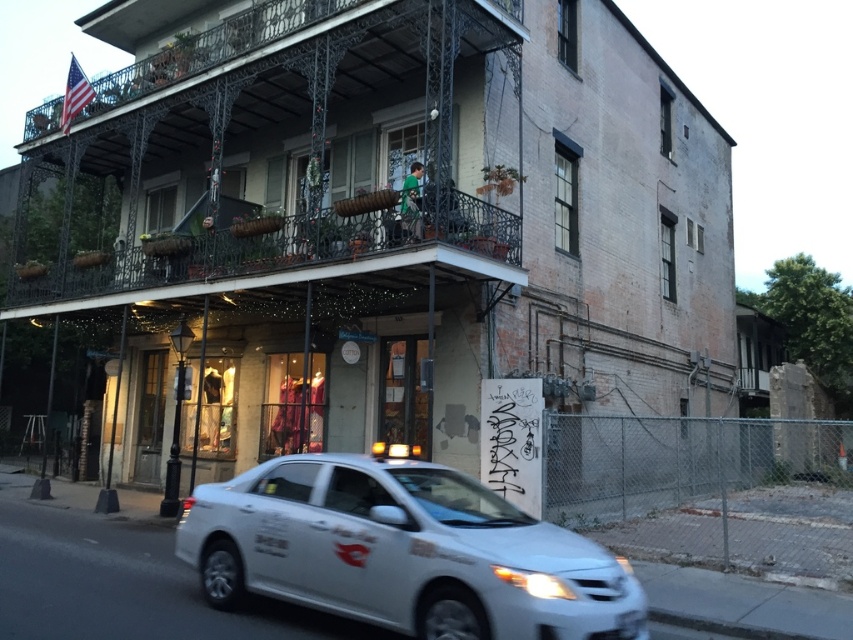
Is black wrought iron balcony at upper center thinner than white matte car at lower center?

In fact, black wrought iron balcony at upper center might be wider than white matte car at lower center.

Does black wrought iron balcony at upper center have a lesser height compared to white matte car at lower center?

In fact, black wrought iron balcony at upper center may be taller than white matte car at lower center.

Identify the location of black wrought iron balcony at upper center. The height and width of the screenshot is (640, 853). (248, 138).